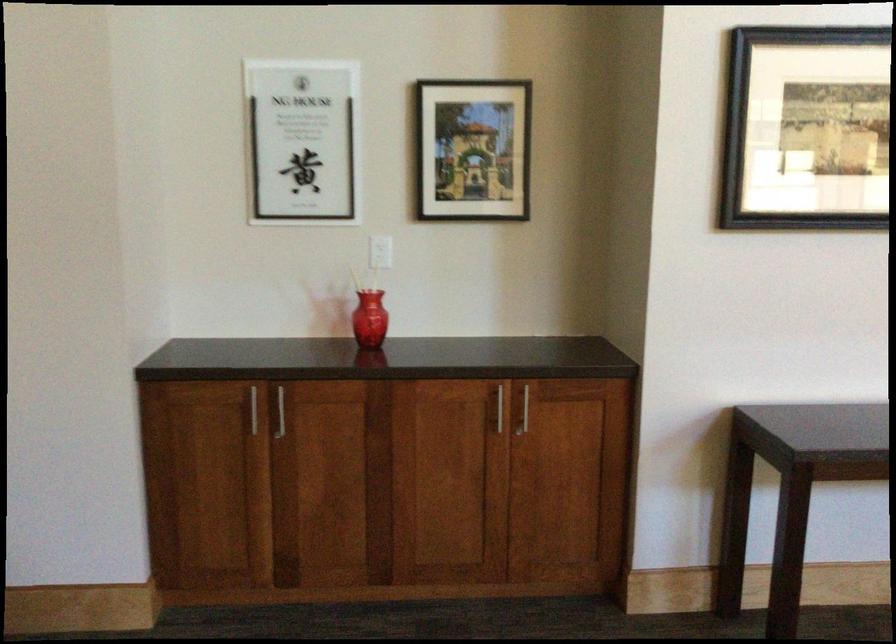
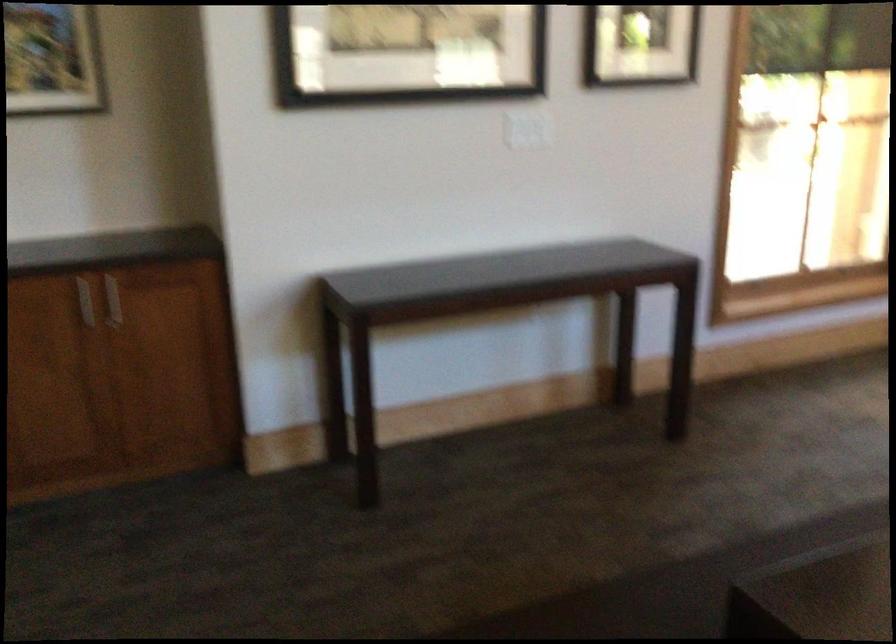
Question: Based on the continuous images, in which direction is the camera rotating? Reply with the corresponding letter.

Choices:
 (A) Left
 (B) Right
 (C) Up
 (D) Down

Answer: (B)